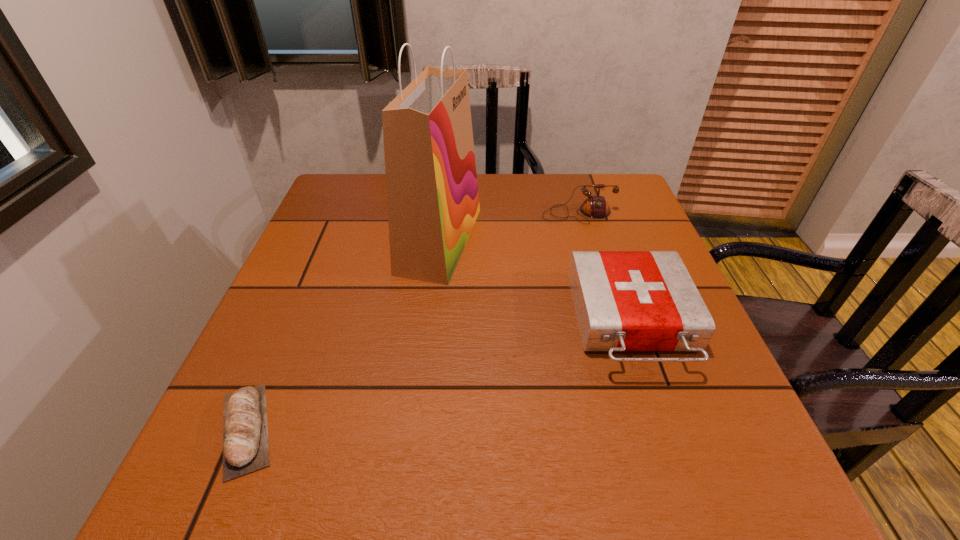
Where is `shopping bag that is at the far edge`? The image size is (960, 540). shopping bag that is at the far edge is located at coordinates (432, 192).

Find the location of a particular element. telephone that is at the far edge is located at coordinates 595,206.

Locate an element on the screen. object that is at the near edge is located at coordinates (245, 429).

Find the location of a particular element. This screenshot has width=960, height=540. object that is at the left edge is located at coordinates (245, 429).

I want to click on telephone that is at the right edge, so click(x=595, y=206).

At what (x,y) coordinates should I click in order to perform the action: click on the first-aid kit present at the right edge. Please return your answer as a coordinate pair (x, y). Looking at the image, I should click on (624, 300).

At what (x,y) coordinates should I click in order to perform the action: click on object present at the near left corner. Please return your answer as a coordinate pair (x, y). The image size is (960, 540). Looking at the image, I should click on (245, 429).

I want to click on object present at the far right corner, so click(595, 206).

Identify the location of free region at the far edge of the desktop. (515, 187).

Find the location of `free spot at the left edge of the desktop`. free spot at the left edge of the desktop is located at coordinates (253, 370).